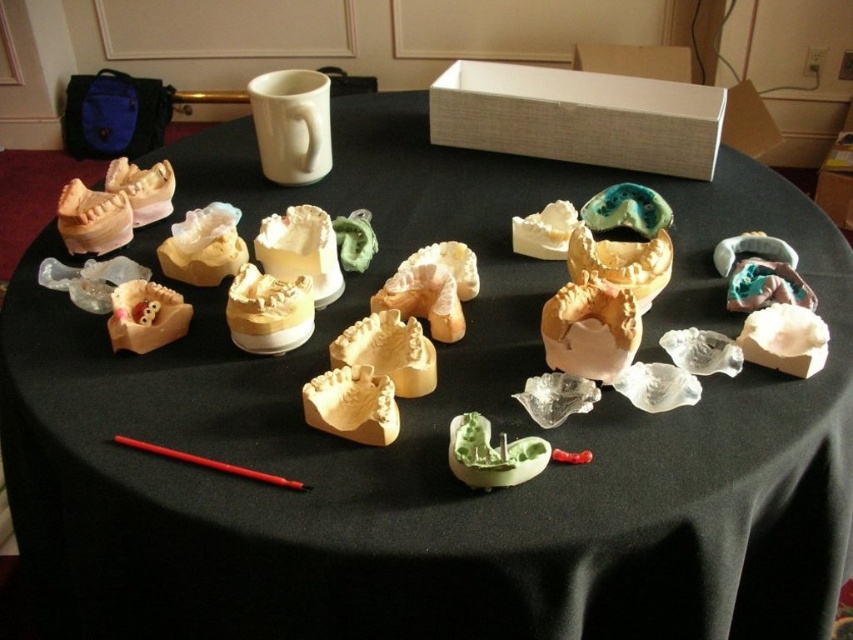
From the picture: You are a dental technician examining the dental models on the round table. You need to determine which object is taller between the matte white plaster cast at center and the matte yellow dental mold at center. Which one is taller?

The matte white plaster cast at center is taller than the matte yellow dental mold at center according to the description.

You are a dental technician working on a project. You have two items on your table, the matte white plaster cast at center and the matte yellow dental mold at center. Which one do you need to use first if you need to start with the larger object?

The matte white plaster cast at center is larger than the matte yellow dental mold at center, so you should use the matte white plaster cast at center first.

You are a dental technician who needs to place a new dental tool that is 4 inches long between the matte yellow dental mold at center and the green matte mold at center. Based on the layout of the table, will the tool fit between them without overlapping either mold?

The distance between the matte yellow dental mold at center and the green matte mold at center is 3.91 inches. Since the tool is 4 inches long, it will not fit between them without overlapping the molds.